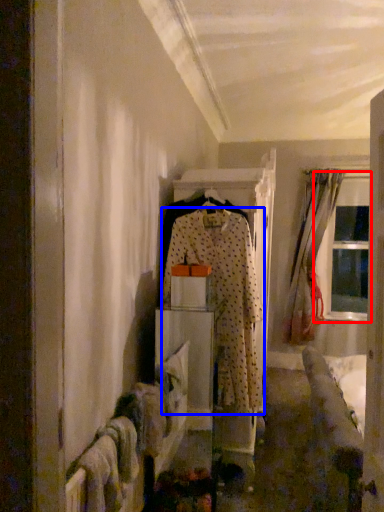
Question: Which object is further to the camera taking this photo, window (highlighted by a red box) or fancy dress (highlighted by a blue box)?

Choices:
 (A) window
 (B) fancy dress

Answer: (A)